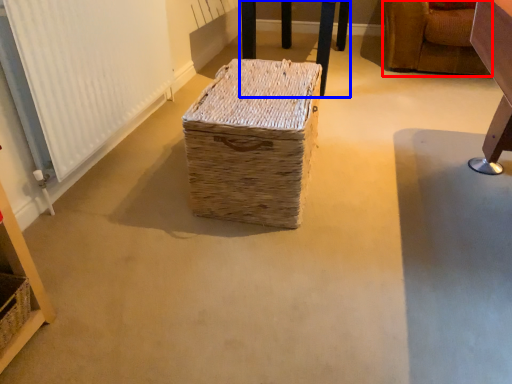
Question: Which of the following is the farthest to the observer, furniture (highlighted by a red box) or furniture (highlighted by a blue box)?

Choices:
 (A) furniture
 (B) furniture

Answer: (B)